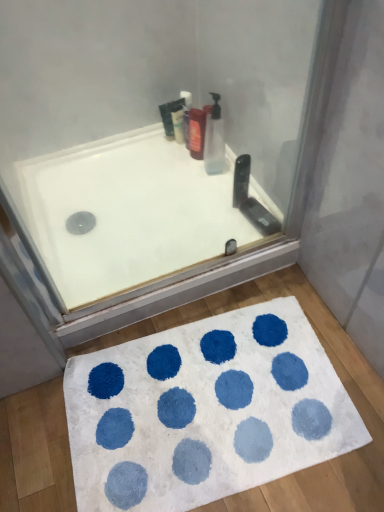
Identify the location of vacant area that lies in front of translucent plastic bottle at upper center, which is the 1th cleaning product from front to back. (212, 194).